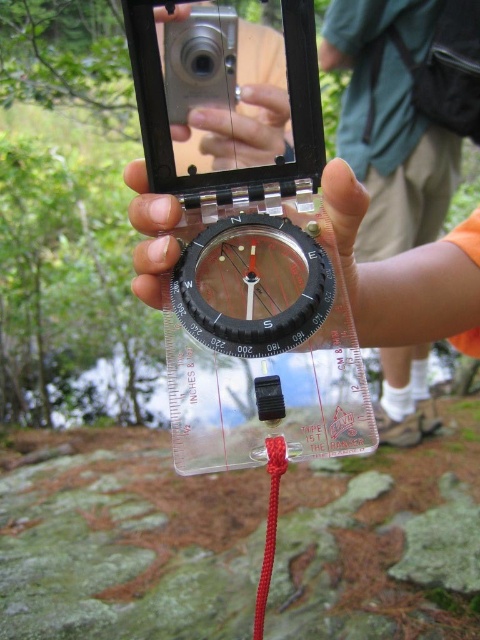
Question: Among these objects, which one is nearest to the camera?

Choices:
 (A) clear plastic compass at center
 (B) silver metallic camera at center
 (C) red cord at center

Answer: (C)

Question: Can you confirm if silver metallic camera at center is positioned to the left of red cord at center?

Choices:
 (A) yes
 (B) no

Answer: (A)

Question: Which object is the closest to the clear plastic compass at center?

Choices:
 (A) red cord at center
 (B) silver metallic camera at center

Answer: (B)

Question: Which point is closer to the camera?

Choices:
 (A) silver metallic camera at center
 (B) red cord at center

Answer: (B)

Question: Is clear plastic compass at center above red cord at center?

Choices:
 (A) yes
 (B) no

Answer: (A)

Question: Is clear plastic compass at center to the left of red cord at center from the viewer's perspective?

Choices:
 (A) yes
 (B) no

Answer: (B)